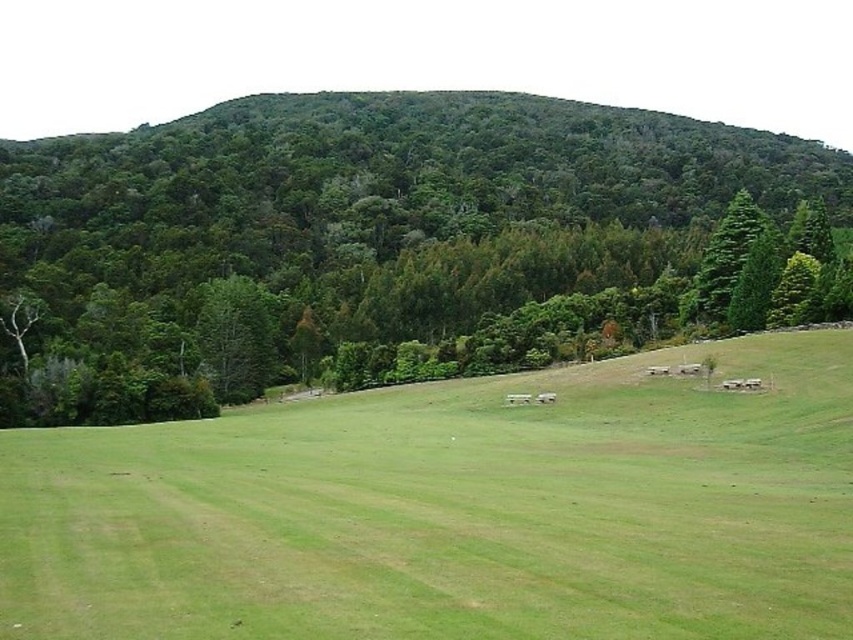
Does green grassy pasture at center appear on the right side of green leafy tree at upper center?

Yes, green grassy pasture at center is to the right of green leafy tree at upper center.

Can you confirm if green grassy pasture at center is thinner than green leafy tree at upper center?

Indeed, green grassy pasture at center has a lesser width compared to green leafy tree at upper center.

You are a GUI agent. You are given a task and a screenshot of the screen. Output one action in this format:
    pyautogui.click(x=<x>, y=<y>)
    Task: Click on the green grassy pasture at center
    The height and width of the screenshot is (640, 853).
    Given the screenshot: What is the action you would take?
    pyautogui.click(x=454, y=512)